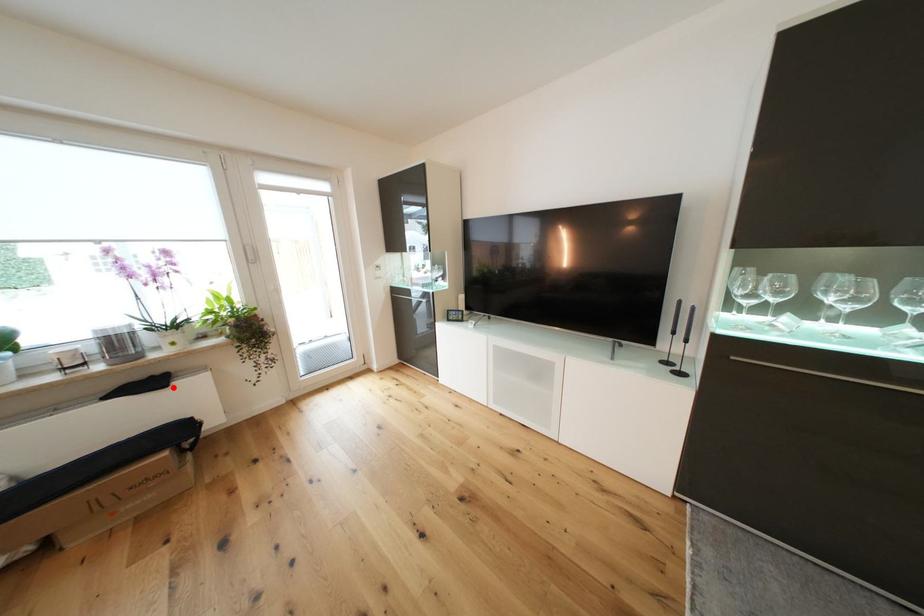
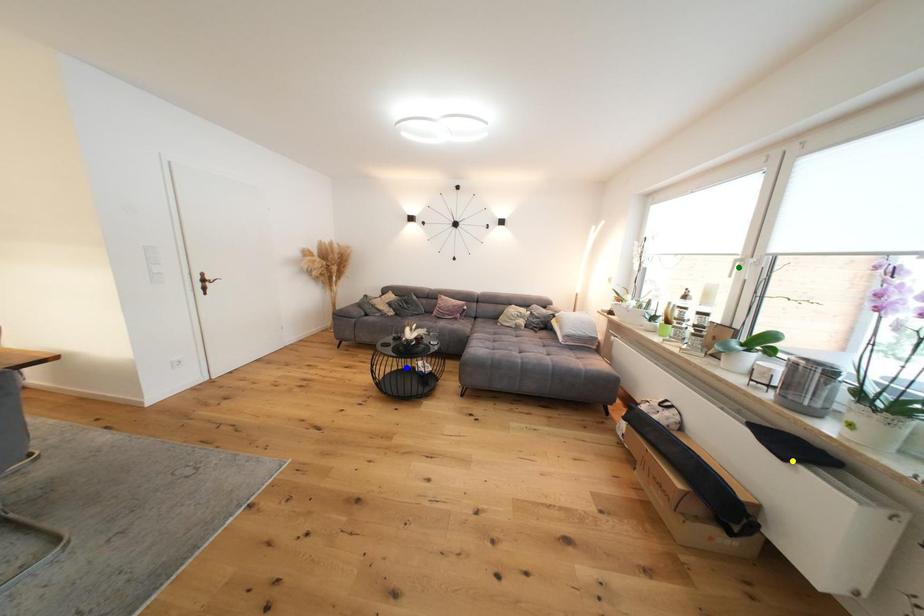
Question: I am providing you with two images of the same scene from different viewpoints. A red point is marked on the first image. You are given multiple points on the second image. In image 2, which mark is for the same physical point as the one in image 1?

Choices:
 (A) blue point
 (B) yellow point
 (C) green point

Answer: (B)